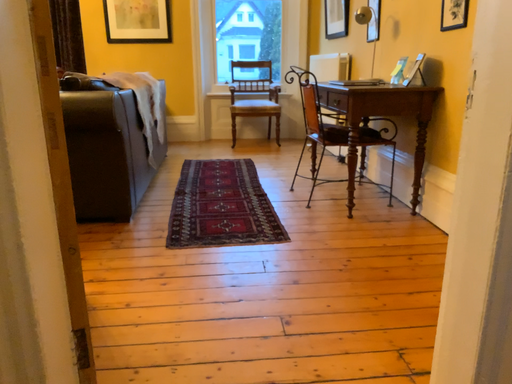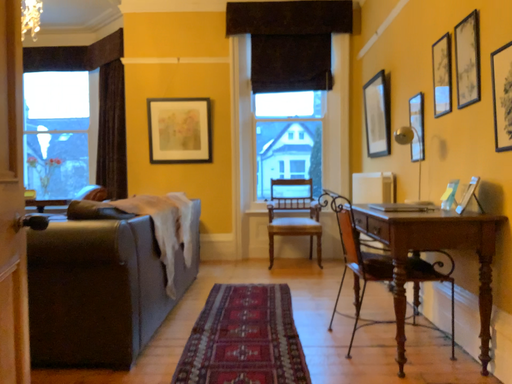
Question: How did the camera likely rotate when shooting the video?

Choices:
 (A) rotated upward
 (B) rotated downward

Answer: (A)